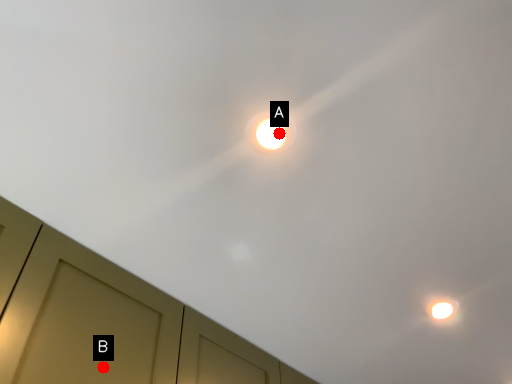
Question: Two points are circled on the image, labeled by A and B beside each circle. Which point is farther from the camera taking this photo?

Choices:
 (A) A is further
 (B) B is further

Answer: (B)